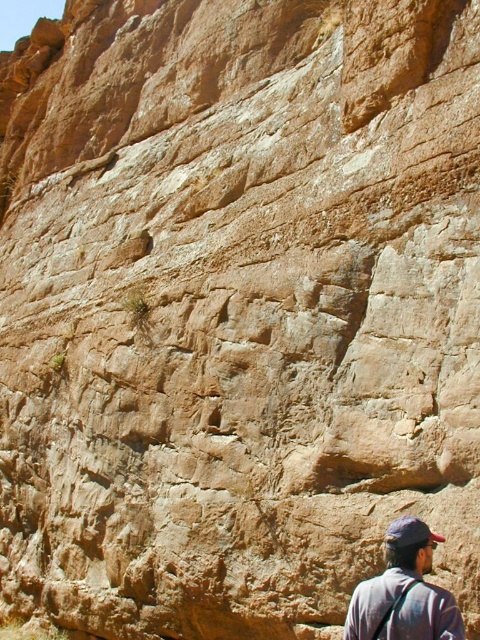
You are a photographer wanting to capture both the dark gray fabric cap at upper right and the dark blue fabric baseball cap at lower right in the same frame. Which cap should you adjust your camera angle to focus on first if you want to ensure both are in view without moving the camera?

The dark gray fabric cap at upper right is not as tall as the dark blue fabric baseball cap at lower right, so you should focus on the taller dark blue fabric baseball cap at lower right first to ensure both are in the frame.

You are a photographer positioned at the center of the image. You want to capture a photo that includes both the rugged rock face and the dark gray fabric cap at upper right. Based on their positions, will the cap be visible in the photo if you frame the shot to include the entire rock face?

The dark gray fabric cap at upper right is located at point (404, 592), which is near the edge of the image. If you frame the shot to include the entire rock face, the cap might be positioned at the very edge of the photo and could be partially or fully cropped out depending on the framing. To ensure visibility, adjust the framing to include the upper right corner where the cap is situated.

You are a photographer trying to capture a shot of both the dark gray fabric cap at upper right and the dark blue fabric baseball cap at lower right in the same frame. Based on their positions, which direction should you move your camera to include both caps in the view?

The dark gray fabric cap at upper right is positioned on the left side of the dark blue fabric baseball cap at lower right. To include both in the frame, you should move your camera to the left to capture the dark gray fabric cap at upper right and then pan towards the right to include the dark blue fabric baseball cap at lower right in the view.